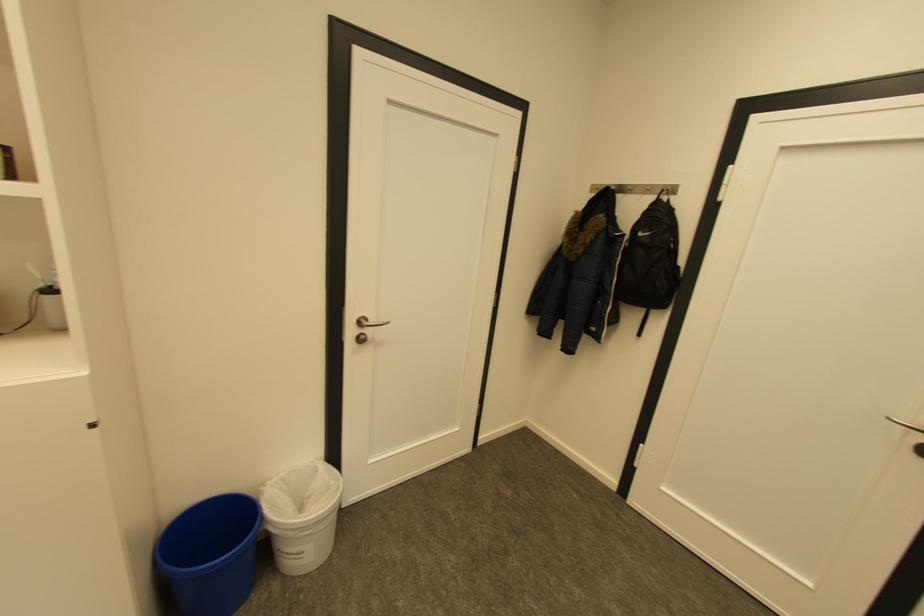
The width and height of the screenshot is (924, 616). Describe the element at coordinates (52, 308) in the screenshot. I see `the white cup` at that location.